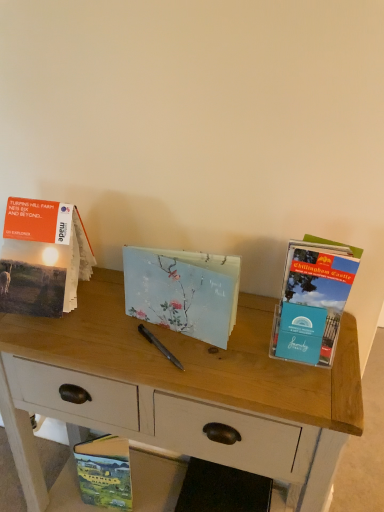
The height and width of the screenshot is (512, 384). What are the coordinates of `free space to the left of blue cardstock brochure at right, which is the 2th book from bottom to top` in the screenshot? It's located at (230, 358).